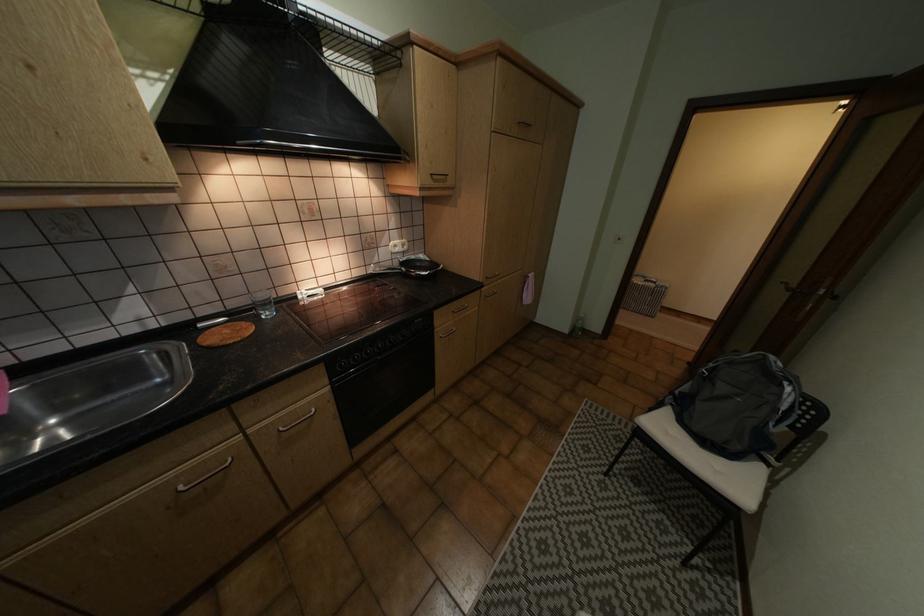
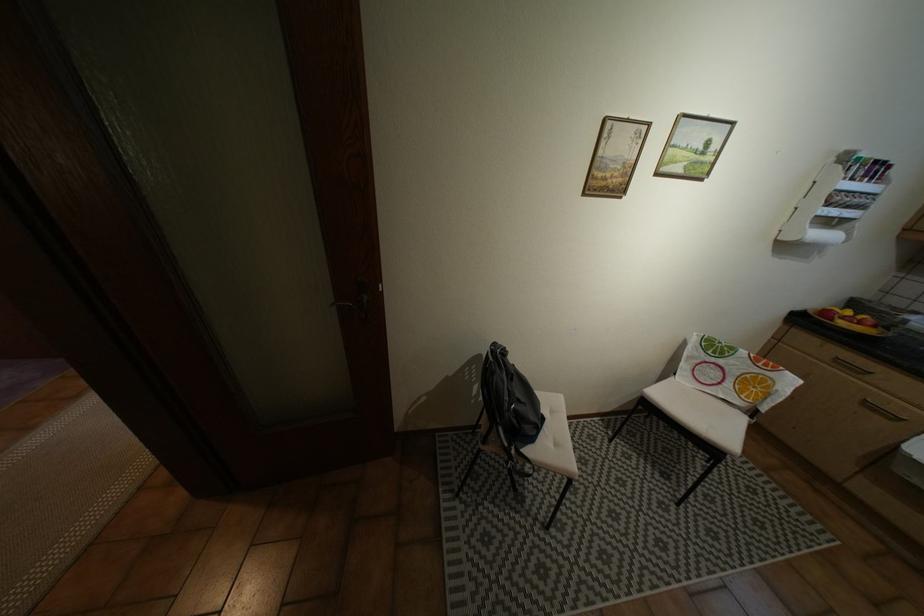
Find the pixel in the second image that matches point 691,421 in the first image.

(542, 438)